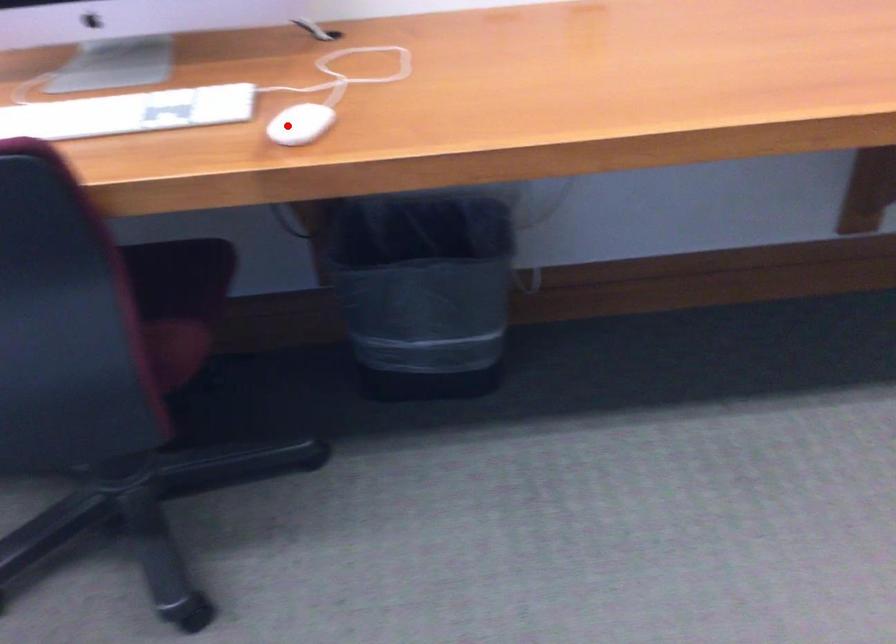
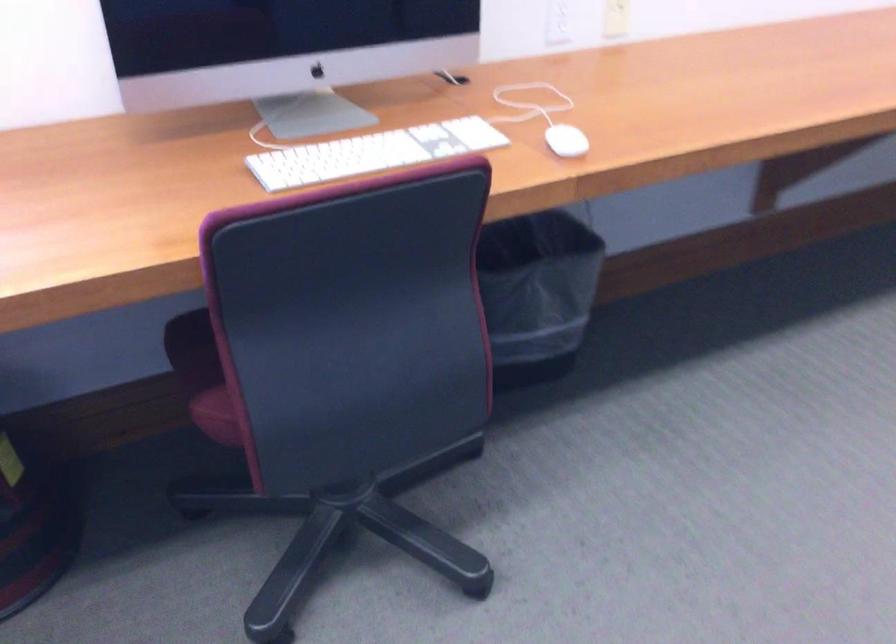
Question: I am providing you with two images of the same scene from different viewpoints. Given a red point in image1, look at the same physical point in image2. Is it:

Choices:
 (A) Closer to the viewpoint
 (B) Farther from the viewpoint

Answer: (B)